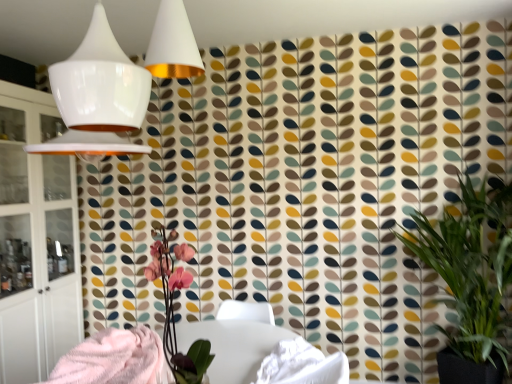
Question: Do you think white glossy table at center is within fluffy pink blanket at lower left, or outside of it?

Choices:
 (A) inside
 (B) outside

Answer: (B)

Question: Is point (223, 337) closer or farther from the camera than point (90, 349)?

Choices:
 (A) closer
 (B) farther

Answer: (B)

Question: Which object is positioned closest to the white glossy lampshade at upper left?

Choices:
 (A) white glossy table at center
 (B) pink matte orchid at center
 (C) fluffy pink blanket at lower left
 (D) green leafy plant at right
 (E) white glass cabinet at left

Answer: (B)

Question: Which object is positioned closest to the green leafy plant at right?

Choices:
 (A) fluffy pink blanket at lower left
 (B) pink matte orchid at center
 (C) white glossy table at center
 (D) white glossy lampshade at upper left
 (E) white glass cabinet at left

Answer: (C)